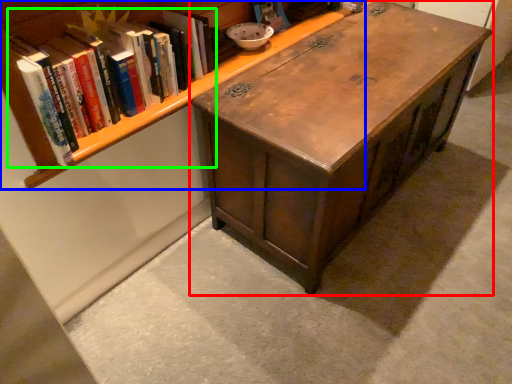
Question: Which object is positioned farthest from table (highlighted by a red box)? Select from bookcase (highlighted by a blue box) and book (highlighted by a green box).

Choices:
 (A) bookcase
 (B) book

Answer: (B)